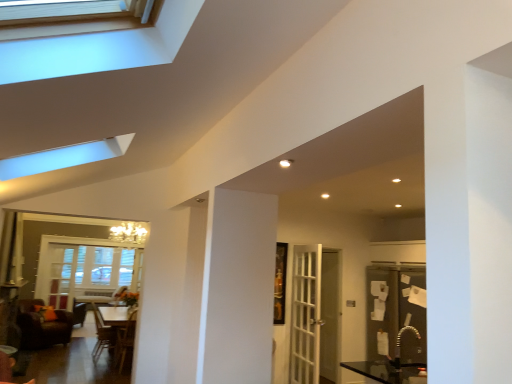
Question: Does clear glass window at upper left, which is the first window in top-to-bottom order, have a smaller size compared to brown leather chair at lower left?

Choices:
 (A) no
 (B) yes

Answer: (B)

Question: Is clear glass window at upper left, marked as the 1th window in a right-to-left arrangement, at the right side of brown leather chair at lower left?

Choices:
 (A) yes
 (B) no

Answer: (A)

Question: Is clear glass window at upper left, which is the first window in top-to-bottom order, taller than brown leather chair at lower left?

Choices:
 (A) yes
 (B) no

Answer: (B)

Question: Is clear glass window at upper left, marked as the 1th window in a right-to-left arrangement, behind brown leather chair at lower left?

Choices:
 (A) no
 (B) yes

Answer: (A)

Question: Is clear glass window at upper left, which is the first window in top-to-bottom order, aimed at brown leather chair at lower left?

Choices:
 (A) no
 (B) yes

Answer: (A)

Question: Is brown leather armchair at lower left, which appears as the 2th armchair when viewed from the left, taller or shorter than dark brown leather armchair at center, the first armchair viewed from the left?

Choices:
 (A) tall
 (B) short

Answer: (A)

Question: In the image, is brown leather armchair at lower left, which appears as the 2th armchair when viewed from the left, positioned in front of or behind dark brown leather armchair at center, marked as the 2th armchair in a right-to-left arrangement?

Choices:
 (A) behind
 (B) front

Answer: (B)

Question: Considering the positions of brown leather armchair at lower left, which appears as the 2th armchair when viewed from the left, and dark brown leather armchair at center, the first armchair viewed from the left, in the image, is brown leather armchair at lower left, which appears as the 2th armchair when viewed from the left, bigger or smaller than dark brown leather armchair at center, the first armchair viewed from the left,?

Choices:
 (A) small
 (B) big

Answer: (A)

Question: Is brown leather armchair at lower left, which is the first armchair from right to left, to the left or to the right of dark brown leather armchair at center, the first armchair viewed from the left, in the image?

Choices:
 (A) left
 (B) right

Answer: (B)

Question: From the image's perspective, is white glossy table at center above or below gold metallic sink at lower right?

Choices:
 (A) above
 (B) below

Answer: (B)

Question: From a real-world perspective, is white glossy table at center physically located above or below gold metallic sink at lower right?

Choices:
 (A) above
 (B) below

Answer: (B)

Question: Is white glossy table at center wider or thinner than gold metallic sink at lower right?

Choices:
 (A) wide
 (B) thin

Answer: (A)

Question: Is white glossy table at center bigger or smaller than gold metallic sink at lower right?

Choices:
 (A) big
 (B) small

Answer: (A)

Question: From their relative heights in the image, would you say dark brown leather armchair at center, marked as the 2th armchair in a right-to-left arrangement, is taller or shorter than brown leather armchair at lower left, which is the first armchair from right to left?

Choices:
 (A) tall
 (B) short

Answer: (B)

Question: Considering the positions of dark brown leather armchair at center, marked as the 2th armchair in a right-to-left arrangement, and brown leather armchair at lower left, which is the first armchair from right to left, in the image, is dark brown leather armchair at center, marked as the 2th armchair in a right-to-left arrangement, wider or thinner than brown leather armchair at lower left, which is the first armchair from right to left,?

Choices:
 (A) wide
 (B) thin

Answer: (A)